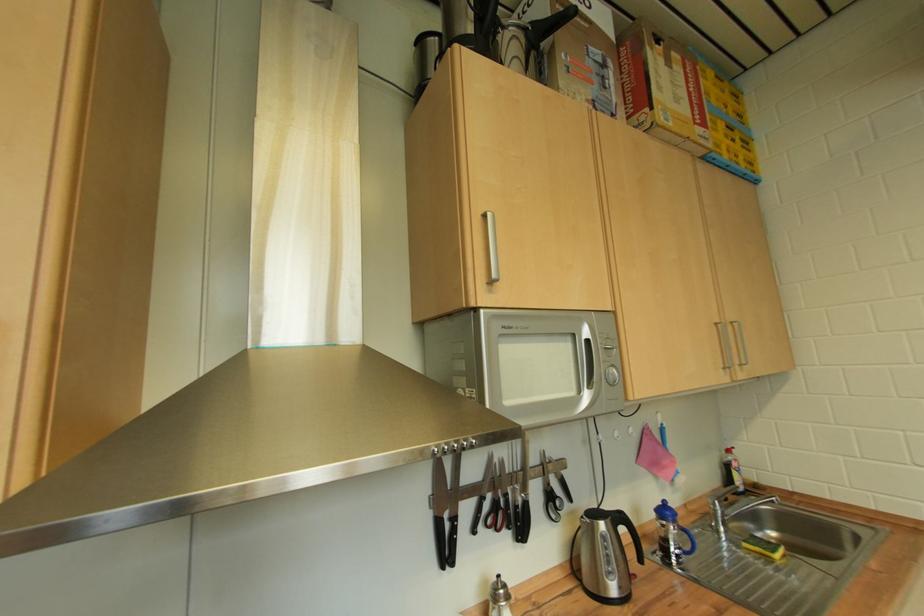
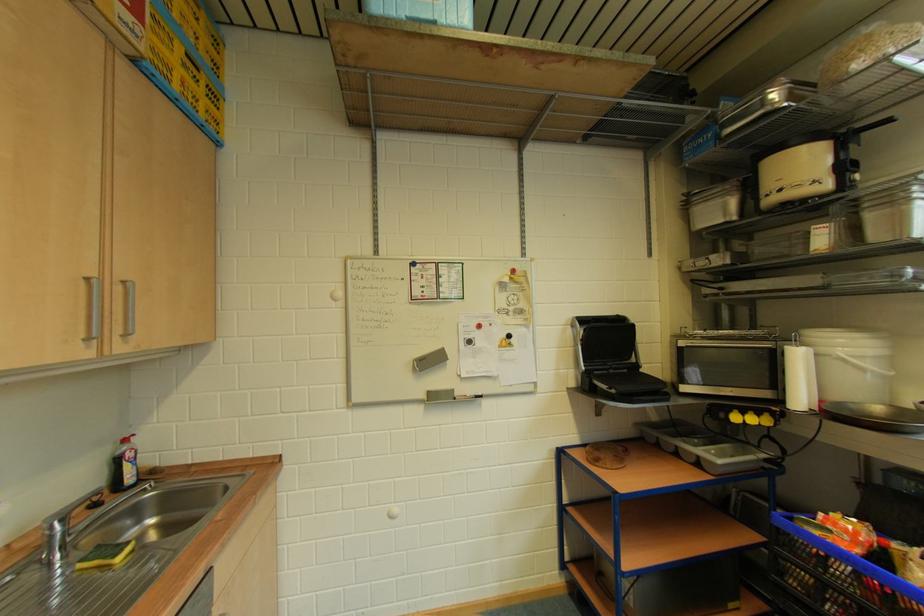
Question: The camera is either moving clockwise (left) or counter-clockwise (right) around the object. The first image is from the beginning of the video and the second image is from the end. Is the camera moving left or right when shooting the video?

Choices:
 (A) Left
 (B) Right

Answer: (A)